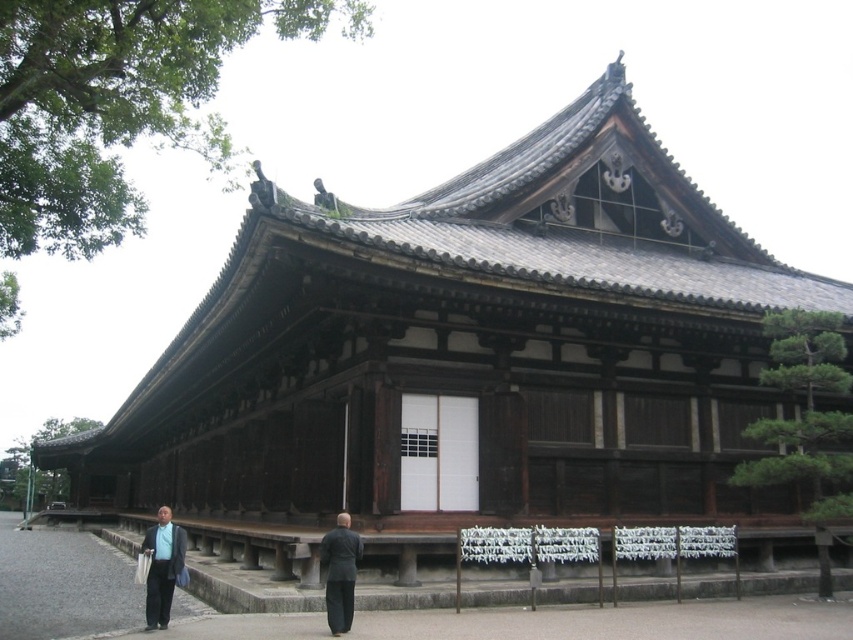
Question: Which point is farther from the camera taking this photo?

Choices:
 (A) (165, 616)
 (B) (334, 589)

Answer: (A)

Question: Among these objects, which one is nearest to the camera?

Choices:
 (A) matte black suit at lower left
 (B) dark gray suit at center

Answer: (B)

Question: Can you confirm if matte black suit at lower left is wider than dark gray suit at center?

Choices:
 (A) yes
 (B) no

Answer: (A)

Question: Which of the following is the farthest from the observer?

Choices:
 (A) (340, 564)
 (B) (175, 525)

Answer: (B)

Question: Is matte black suit at lower left further to the viewer compared to dark gray suit at center?

Choices:
 (A) no
 (B) yes

Answer: (B)

Question: Is matte black suit at lower left to the left of dark gray suit at center from the viewer's perspective?

Choices:
 (A) no
 (B) yes

Answer: (B)